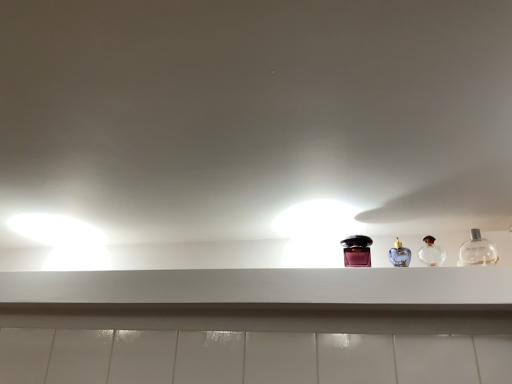
Question: Is clear glass perfume at center right, placed as the 2th bottle when sorted from left to right, completely or partially outside of white matte shelf at center?

Choices:
 (A) yes
 (B) no

Answer: (A)

Question: From the image's perspective, is clear glass perfume at center right, placed as the 2th bottle when sorted from left to right, beneath white matte shelf at center?

Choices:
 (A) yes
 (B) no

Answer: (B)

Question: Is clear glass perfume at center right, the second bottle viewed from the right, shorter than white matte shelf at center?

Choices:
 (A) no
 (B) yes

Answer: (A)

Question: From the image's perspective, is clear glass perfume at center right, the second bottle viewed from the right, on top of white matte shelf at center?

Choices:
 (A) no
 (B) yes

Answer: (B)

Question: Is clear glass perfume at center right, the second bottle viewed from the right, far from white matte shelf at center?

Choices:
 (A) no
 (B) yes

Answer: (A)

Question: From a real-world perspective, is clear glass perfume at center right, the second bottle viewed from the right, positioned above or below shiny purple bottle at center, positioned as the third bottle in right-to-left order?

Choices:
 (A) below
 (B) above

Answer: (A)

Question: Relative to shiny purple bottle at center, positioned as the 1th bottle in left-to-right order, is clear glass perfume at center right, the second bottle viewed from the right, in front or behind?

Choices:
 (A) behind
 (B) front

Answer: (B)

Question: From their relative heights in the image, would you say clear glass perfume at center right, the second bottle viewed from the right, is taller or shorter than shiny purple bottle at center, positioned as the 1th bottle in left-to-right order?

Choices:
 (A) tall
 (B) short

Answer: (B)

Question: Does point (433, 251) appear closer or farther from the camera than point (346, 256)?

Choices:
 (A) closer
 (B) farther

Answer: (B)

Question: Considering their positions, is white matte shelf at center located in front of or behind clear glass bottle at right, the 3th bottle viewed from the left?

Choices:
 (A) front
 (B) behind

Answer: (A)

Question: Is point (478, 299) positioned closer to the camera than point (480, 241)?

Choices:
 (A) farther
 (B) closer

Answer: (B)

Question: Would you say white matte shelf at center is inside or outside clear glass bottle at right, which is the 1th bottle in right-to-left order?

Choices:
 (A) outside
 (B) inside

Answer: (A)

Question: Based on their positions, is white matte shelf at center located to the left or right of clear glass bottle at right, the 3th bottle viewed from the left?

Choices:
 (A) left
 (B) right

Answer: (A)

Question: From the image's perspective, is clear glass bottle at right, the 3th bottle viewed from the left, above or below clear glass perfume at center right, the second bottle viewed from the right?

Choices:
 (A) above
 (B) below

Answer: (A)

Question: In the image, is clear glass bottle at right, the 3th bottle viewed from the left, positioned in front of or behind clear glass perfume at center right, placed as the 2th bottle when sorted from left to right?

Choices:
 (A) front
 (B) behind

Answer: (A)